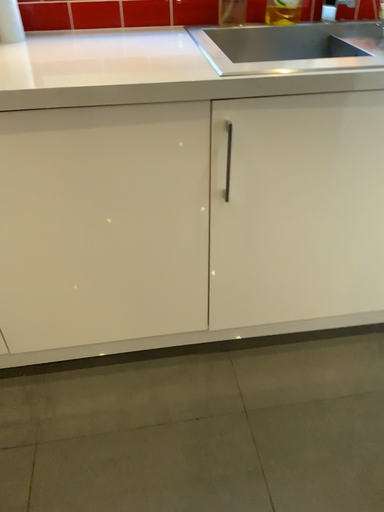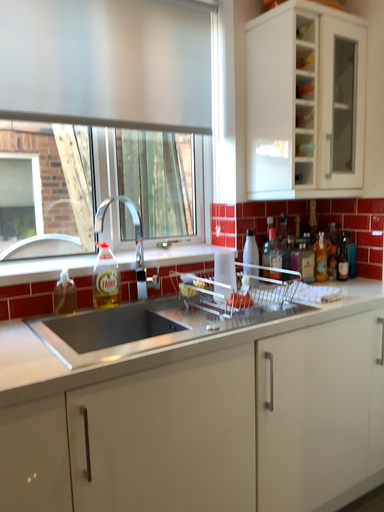
Question: How did the camera likely rotate when shooting the video?

Choices:
 (A) rotated downward
 (B) rotated upward

Answer: (B)